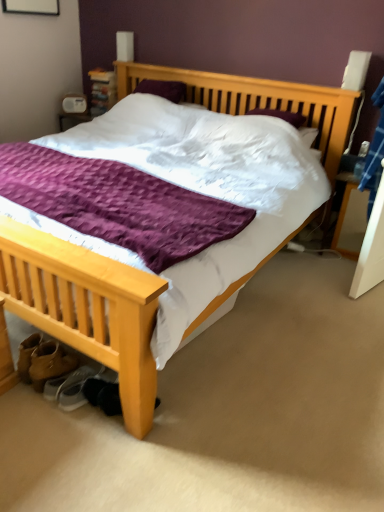
Question: Is wooden nightstand at right positioned far away from light wood bed at center?

Choices:
 (A) no
 (B) yes

Answer: (A)

Question: Could you tell me if wooden nightstand at right is facing light wood bed at center?

Choices:
 (A) yes
 (B) no

Answer: (B)

Question: Is wooden nightstand at right bigger than light wood bed at center?

Choices:
 (A) no
 (B) yes

Answer: (A)

Question: From the image's perspective, is wooden nightstand at right above light wood bed at center?

Choices:
 (A) yes
 (B) no

Answer: (B)

Question: Is wooden nightstand at right completely or partially outside of light wood bed at center?

Choices:
 (A) yes
 (B) no

Answer: (A)

Question: Is point (129, 333) positioned closer to the camera than point (342, 230)?

Choices:
 (A) closer
 (B) farther

Answer: (A)

Question: From a real-world perspective, is light wood bed at center positioned above or below wooden nightstand at right?

Choices:
 (A) above
 (B) below

Answer: (A)

Question: Is light wood bed at center spatially inside wooden nightstand at right, or outside of it?

Choices:
 (A) inside
 (B) outside

Answer: (B)

Question: Would you say light wood bed at center is to the left or to the right of wooden nightstand at right in the picture?

Choices:
 (A) right
 (B) left

Answer: (B)

Question: Considering the positions of white fabric shoe at lower left, arranged as the 2th shoe when viewed from the right, and leather tan boot at lower left in the image, is white fabric shoe at lower left, arranged as the 2th shoe when viewed from the right, wider or thinner than leather tan boot at lower left?

Choices:
 (A) wide
 (B) thin

Answer: (A)

Question: Considering their positions, is white fabric shoe at lower left, which ranks as the 1th shoe in left-to-right order, located in front of or behind leather tan boot at lower left?

Choices:
 (A) front
 (B) behind

Answer: (B)

Question: In terms of height, does white fabric shoe at lower left, which ranks as the 1th shoe in left-to-right order, look taller or shorter compared to leather tan boot at lower left?

Choices:
 (A) tall
 (B) short

Answer: (B)

Question: From a real-world perspective, is white fabric shoe at lower left, arranged as the 2th shoe when viewed from the right, above or below leather tan boot at lower left?

Choices:
 (A) above
 (B) below

Answer: (B)

Question: Would you say light wood bed at center is to the left or to the right of leather tan boot at lower left in the picture?

Choices:
 (A) right
 (B) left

Answer: (A)

Question: From the image's perspective, is light wood bed at center above or below leather tan boot at lower left?

Choices:
 (A) below
 (B) above

Answer: (B)